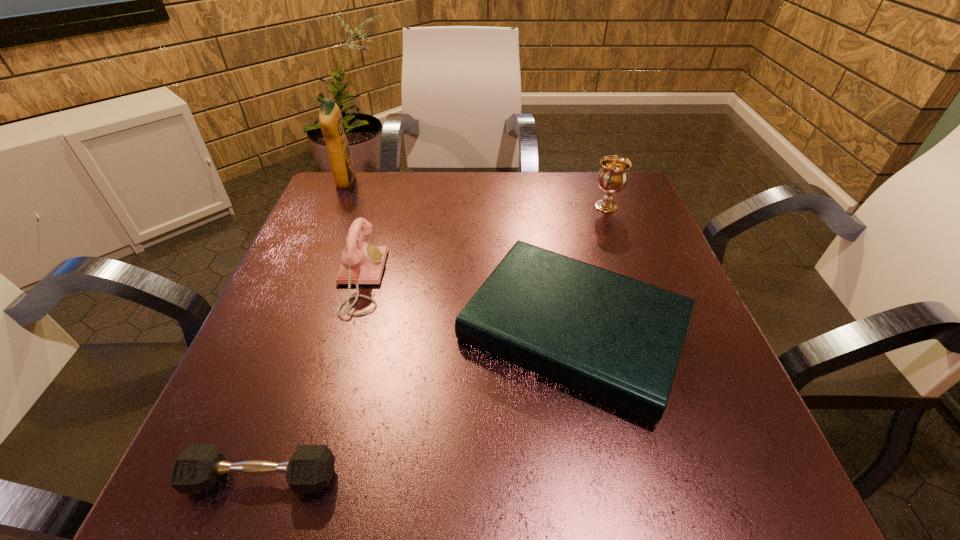
Find the location of a particular element. The image size is (960, 540). detergent is located at coordinates (330, 119).

The height and width of the screenshot is (540, 960). Find the location of `the tallest object`. the tallest object is located at coordinates (330, 119).

Where is `the second farthest object`? The width and height of the screenshot is (960, 540). the second farthest object is located at coordinates (613, 175).

Identify the location of telephone. Image resolution: width=960 pixels, height=540 pixels. (362, 263).

I want to click on book, so click(618, 340).

Where is `dumbbell`? dumbbell is located at coordinates (198, 468).

I want to click on vacant space located on the label of the tallest object, so click(425, 182).

At what (x,y) coordinates should I click in order to perform the action: click on free space located on the back of the chalice. Please return your answer as a coordinate pair (x, y). The width and height of the screenshot is (960, 540). Looking at the image, I should click on (599, 188).

This screenshot has width=960, height=540. Find the location of `vacant area situated 0.330m on the dial of the telephone`. vacant area situated 0.330m on the dial of the telephone is located at coordinates (542, 280).

Where is `vacant region located 0.350m on the left of the book`? The height and width of the screenshot is (540, 960). vacant region located 0.350m on the left of the book is located at coordinates (266, 330).